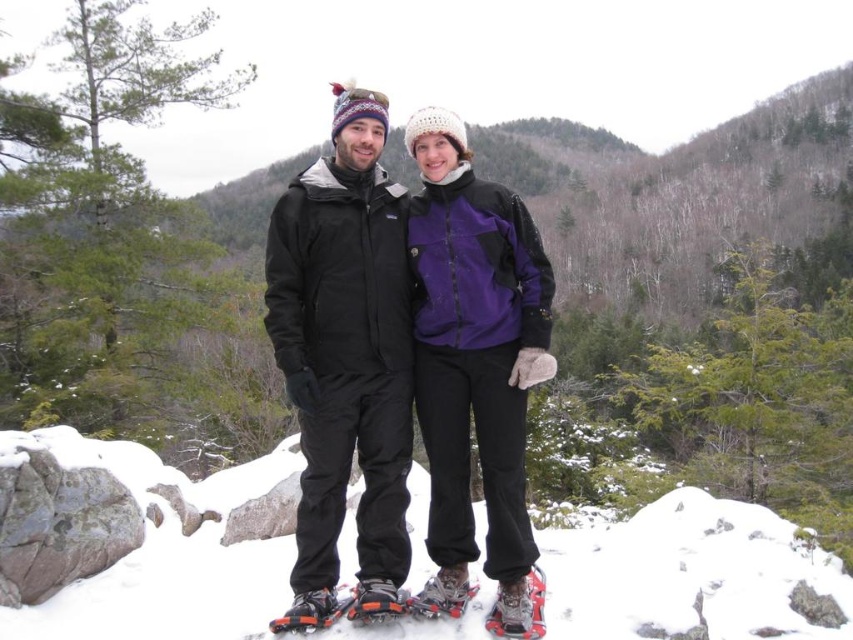
You are a photographer trying to capture a closeup shot of the orange and black snowshoes at center and the brushed metal snowshoe at lower center. Can you fit both in the frame if your camera has a minimum focus distance of 17 centimeters?

The orange and black snowshoes at center is 17.15 centimeters away from the brushed metal snowshoe at lower center. Since the camera requires a minimum focus distance of 17 centimeters, the distance between them is just slightly over the required distance. Therefore, you can fit both in the frame as the distance meets the camera requirement.

You are a photographer trying to capture a photo of the brushed metal snowshoe at lower center. The camera you are using has a limited field of view. Based on its coordinates at point 0.950, 0.610, can you estimate whether it will be visible in the center of the photo?

The brushed metal snowshoe at lower center is located at point (519, 608), which is near the lower right corner of the image. Since the camera has a limited field of view, it might not capture the snowshoe at the center unless adjusted. Therefore, it won

You are planning to cross a frozen lake and need to choose between the brushed metal snowshoe at lower center and the silver metallic snowshoe at center. Which one would provide better support due to its size?

The brushed metal snowshoe at lower center is larger in size than the silver metallic snowshoe at center, so it would provide better support for crossing the frozen lake.